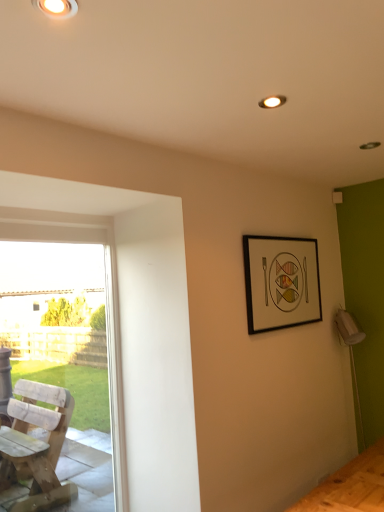
Question: Is black matte picture frame at upper right thinner than wooden chair at left?

Choices:
 (A) no
 (B) yes

Answer: (B)

Question: Is black matte picture frame at upper right oriented away from wooden chair at left?

Choices:
 (A) yes
 (B) no

Answer: (B)

Question: Considering the relative positions of black matte picture frame at upper right and wooden chair at left in the image provided, is black matte picture frame at upper right behind wooden chair at left?

Choices:
 (A) yes
 (B) no

Answer: (A)

Question: Could you tell me if black matte picture frame at upper right is facing wooden chair at left?

Choices:
 (A) no
 (B) yes

Answer: (A)

Question: Would you say black matte picture frame at upper right is outside wooden chair at left?

Choices:
 (A) no
 (B) yes

Answer: (B)

Question: Is black matte picture frame at upper right bigger than wooden chair at left?

Choices:
 (A) no
 (B) yes

Answer: (A)

Question: Is wooden chair at left not inside black matte picture frame at upper right?

Choices:
 (A) no
 (B) yes

Answer: (B)

Question: Considering the relative positions of wooden chair at left and black matte picture frame at upper right in the image provided, is wooden chair at left to the right of black matte picture frame at upper right from the viewer's perspective?

Choices:
 (A) no
 (B) yes

Answer: (A)

Question: From the image's perspective, is wooden chair at left on top of black matte picture frame at upper right?

Choices:
 (A) no
 (B) yes

Answer: (A)

Question: From the image's perspective, is wooden chair at left under black matte picture frame at upper right?

Choices:
 (A) yes
 (B) no

Answer: (A)

Question: Does wooden chair at left turn towards black matte picture frame at upper right?

Choices:
 (A) yes
 (B) no

Answer: (B)

Question: Is black matte picture frame at upper right surrounded by wooden chair at left?

Choices:
 (A) no
 (B) yes

Answer: (A)

Question: From the image's perspective, is matte white ceiling light at upper left over wooden chair at left?

Choices:
 (A) yes
 (B) no

Answer: (A)